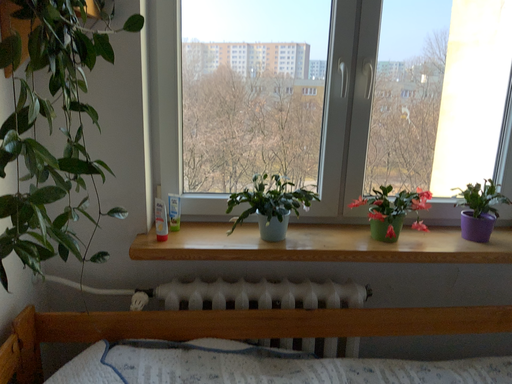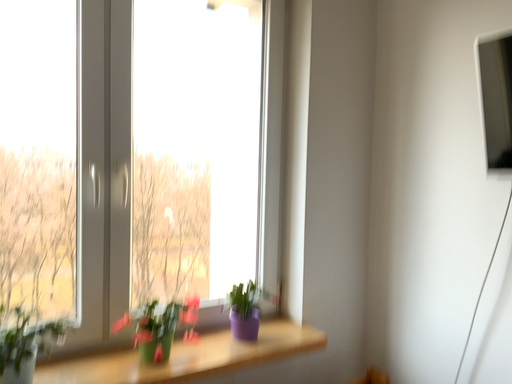
Question: Which way did the camera rotate in the video?

Choices:
 (A) rotated upward
 (B) rotated downward

Answer: (A)